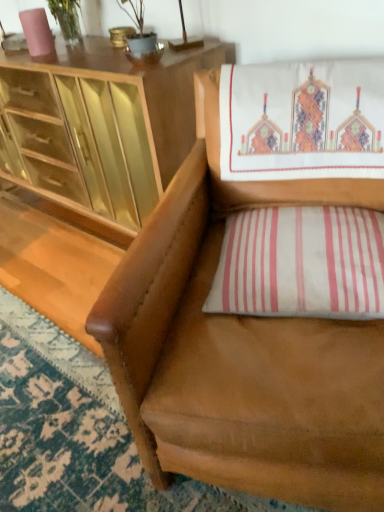
Question: Is matte wood cabinet at upper left not close to white striped pillow at lower right?

Choices:
 (A) no
 (B) yes

Answer: (A)

Question: Can you confirm if matte wood cabinet at upper left is taller than white striped pillow at lower right?

Choices:
 (A) yes
 (B) no

Answer: (A)

Question: Is matte wood cabinet at upper left beside white striped pillow at lower right?

Choices:
 (A) yes
 (B) no

Answer: (B)

Question: Does matte wood cabinet at upper left have a lesser height compared to white striped pillow at lower right?

Choices:
 (A) yes
 (B) no

Answer: (B)

Question: From a real-world perspective, is matte wood cabinet at upper left below white striped pillow at lower right?

Choices:
 (A) no
 (B) yes

Answer: (B)

Question: Relative to white striped pillow at lower right, is brown leather chair at center in front or behind?

Choices:
 (A) behind
 (B) front

Answer: (B)

Question: Is brown leather chair at center taller or shorter than white striped pillow at lower right?

Choices:
 (A) short
 (B) tall

Answer: (B)

Question: From the image's perspective, is brown leather chair at center positioned above or below white striped pillow at lower right?

Choices:
 (A) above
 (B) below

Answer: (B)

Question: Would you say brown leather chair at center is to the left or to the right of white striped pillow at lower right in the picture?

Choices:
 (A) left
 (B) right

Answer: (A)

Question: In the image, is brown leather chair at center positioned in front of or behind matte wood cabinet at upper left?

Choices:
 (A) front
 (B) behind

Answer: (A)

Question: Visually, is brown leather chair at center positioned to the left or to the right of matte wood cabinet at upper left?

Choices:
 (A) right
 (B) left

Answer: (A)

Question: Considering the positions of brown leather chair at center and matte wood cabinet at upper left in the image, is brown leather chair at center taller or shorter than matte wood cabinet at upper left?

Choices:
 (A) short
 (B) tall

Answer: (B)

Question: From the image's perspective, is brown leather chair at center located above or below matte wood cabinet at upper left?

Choices:
 (A) above
 (B) below

Answer: (B)

Question: Is white striped pillow at lower right to the left or to the right of matte wood cabinet at upper left in the image?

Choices:
 (A) left
 (B) right

Answer: (B)

Question: From a real-world perspective, is white striped pillow at lower right physically located above or below matte wood cabinet at upper left?

Choices:
 (A) above
 (B) below

Answer: (A)